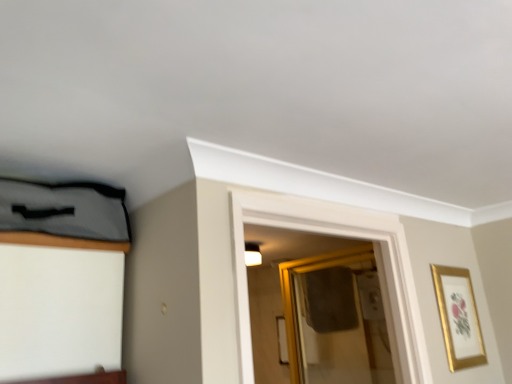
Question: Is gold metallic picture frame at upper right wider or thinner than gold-framed mirror at center?

Choices:
 (A) wide
 (B) thin

Answer: (B)

Question: Considering the positions of point (437, 274) and point (320, 319), is point (437, 274) closer or farther from the camera than point (320, 319)?

Choices:
 (A) farther
 (B) closer

Answer: (B)

Question: In the image, is gold metallic picture frame at upper right positioned in front of or behind gold-framed mirror at center?

Choices:
 (A) front
 (B) behind

Answer: (A)

Question: Is gold-framed mirror at center in front of or behind gold metallic picture frame at upper right in the image?

Choices:
 (A) behind
 (B) front

Answer: (A)

Question: From the image's perspective, is gold-framed mirror at center located above or below gold metallic picture frame at upper right?

Choices:
 (A) above
 (B) below

Answer: (B)

Question: Looking at their shapes, would you say gold-framed mirror at center is wider or thinner than gold metallic picture frame at upper right?

Choices:
 (A) thin
 (B) wide

Answer: (B)

Question: Considering the positions of gold-framed mirror at center and gold metallic picture frame at upper right in the image, is gold-framed mirror at center bigger or smaller than gold metallic picture frame at upper right?

Choices:
 (A) small
 (B) big

Answer: (B)